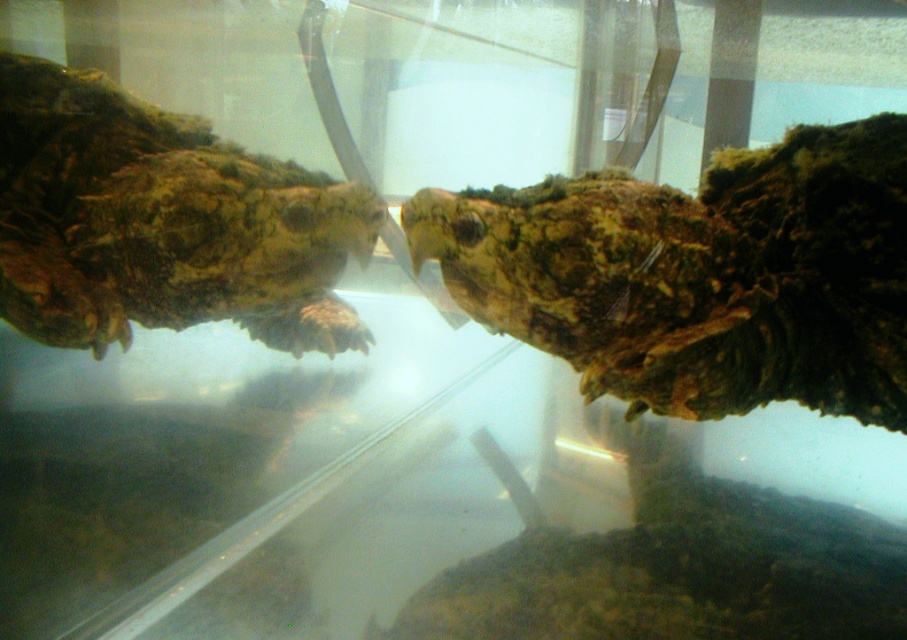
Question: Is textured brown reptile at center bigger than green mossy turtle head at left?

Choices:
 (A) no
 (B) yes

Answer: (A)

Question: Can you confirm if textured brown reptile at center is bigger than green mossy turtle head at left?

Choices:
 (A) yes
 (B) no

Answer: (B)

Question: Which point appears closest to the camera in this image?

Choices:
 (A) (792, 385)
 (B) (198, 301)

Answer: (A)

Question: Does textured brown reptile at center have a greater width compared to green mossy turtle head at left?

Choices:
 (A) yes
 (B) no

Answer: (A)

Question: Which point appears farthest from the camera in this image?

Choices:
 (A) (502, 188)
 (B) (57, 339)

Answer: (B)